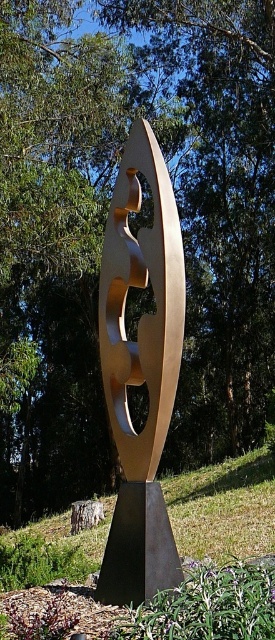
You are an art installer trying to place a new sculpture that is 5 meters long. You see the gold polished metal abstract art at center and the gold polished sculpture at center in the image. Can you fit the new sculpture between them without overlapping?

The distance between the gold polished metal abstract art at center and the gold polished sculpture at center is 4.85 meters. Since the new sculpture is 5 meters long, it would not fit between them as the space is slightly shorter than the sculpture.

You are standing in front of the sculpture and want to touch both the gold polished metal abstract art at center and the gold polished sculpture at center. Which one can you reach without moving your position?

The gold polished metal abstract art at center is closer to you, so you can reach it without moving, but the gold polished sculpture at center is further away and requires moving closer.

What are the coordinates of the gold polished metal abstract art at center?

The gold polished metal abstract art at center is located at coordinates point (141, 371).